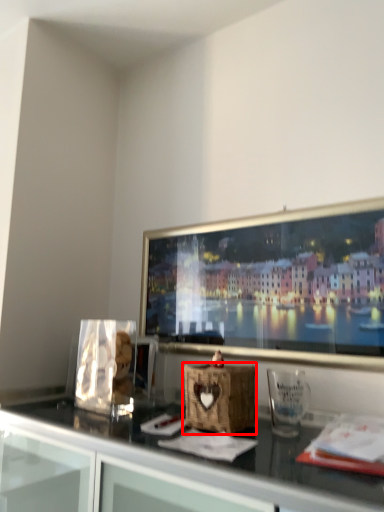
Question: From the image's perspective, where is basket (annotated by the red box) located relative to glass vase?

Choices:
 (A) below
 (B) above

Answer: (A)